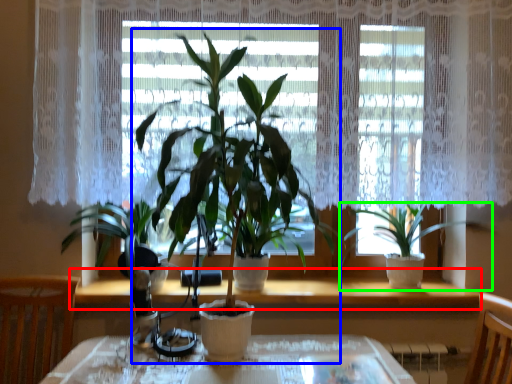
Question: Which object is the farthest from window sill (highlighted by a red box)? Choose among these: houseplant (highlighted by a blue box) or houseplant (highlighted by a green box).

Choices:
 (A) houseplant
 (B) houseplant

Answer: (A)